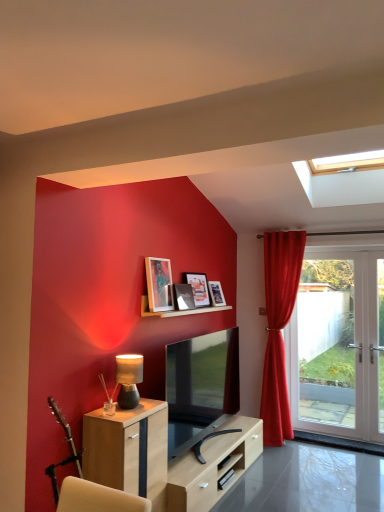
Question: From the image's perspective, is matte wooden picture frame at upper center, arranged as the third picture frame when viewed from the front, beneath matte glass picture frame at upper center, which is counted as the second picture frame, starting from the front?

Choices:
 (A) yes
 (B) no

Answer: (B)

Question: Can you confirm if matte wooden picture frame at upper center, arranged as the third picture frame when viewed from the front, is positioned to the left of matte glass picture frame at upper center, which is counted as the second picture frame, starting from the front?

Choices:
 (A) no
 (B) yes

Answer: (A)

Question: Is matte wooden picture frame at upper center, acting as the second picture frame starting from the back, further to the viewer compared to matte glass picture frame at upper center, which appears as the 3th picture frame when viewed from the back?

Choices:
 (A) no
 (B) yes

Answer: (B)

Question: Could you tell me if matte wooden picture frame at upper center, arranged as the third picture frame when viewed from the front, is turned towards matte glass picture frame at upper center, which appears as the 3th picture frame when viewed from the back?

Choices:
 (A) no
 (B) yes

Answer: (A)

Question: Considering the relative sizes of matte wooden picture frame at upper center, acting as the second picture frame starting from the back, and matte glass picture frame at upper center, which appears as the 3th picture frame when viewed from the back, in the image provided, is matte wooden picture frame at upper center, acting as the second picture frame starting from the back, wider than matte glass picture frame at upper center, which appears as the 3th picture frame when viewed from the back,?

Choices:
 (A) yes
 (B) no

Answer: (A)

Question: Does matte wooden picture frame at upper center, acting as the second picture frame starting from the back, lie in front of matte glass picture frame at upper center, which appears as the 3th picture frame when viewed from the back?

Choices:
 (A) no
 (B) yes

Answer: (A)

Question: From a real-world perspective, is light wood cabinet at lower left over matte black tv at center?

Choices:
 (A) yes
 (B) no

Answer: (B)

Question: Is light wood cabinet at lower left further to the viewer compared to matte black tv at center?

Choices:
 (A) yes
 (B) no

Answer: (B)

Question: Is light wood cabinet at lower left touching matte black tv at center?

Choices:
 (A) yes
 (B) no

Answer: (B)

Question: Is light wood cabinet at lower left turned away from matte black tv at center?

Choices:
 (A) yes
 (B) no

Answer: (B)

Question: Is light wood cabinet at lower left closer to the viewer compared to matte black tv at center?

Choices:
 (A) yes
 (B) no

Answer: (A)

Question: From a real-world perspective, is light wood cabinet at lower left located beneath matte black tv at center?

Choices:
 (A) yes
 (B) no

Answer: (A)

Question: Considering the relative sizes of matte wooden picture frame at upper center, acting as the second picture frame starting from the back, and velvet red curtain at right in the image provided, is matte wooden picture frame at upper center, acting as the second picture frame starting from the back, bigger than velvet red curtain at right?

Choices:
 (A) yes
 (B) no

Answer: (B)